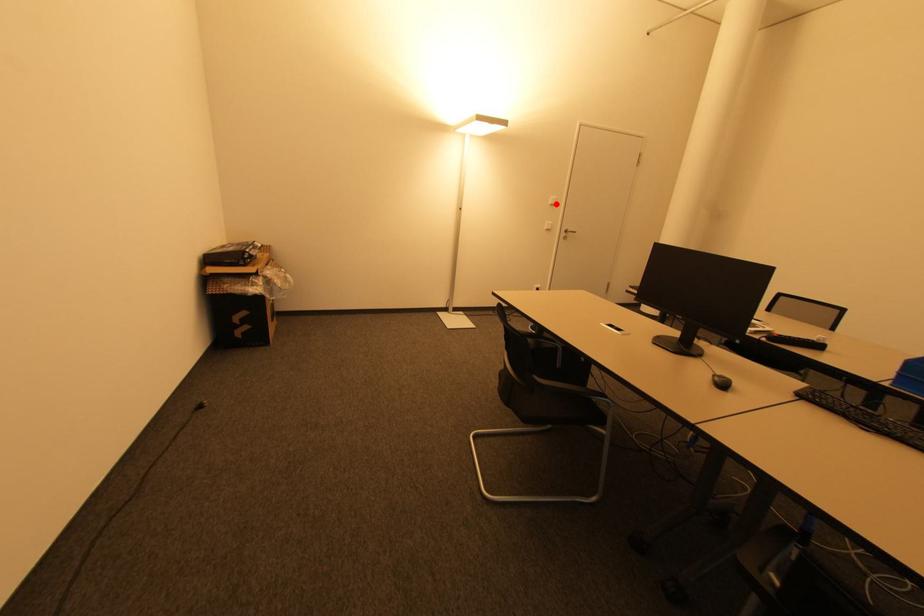
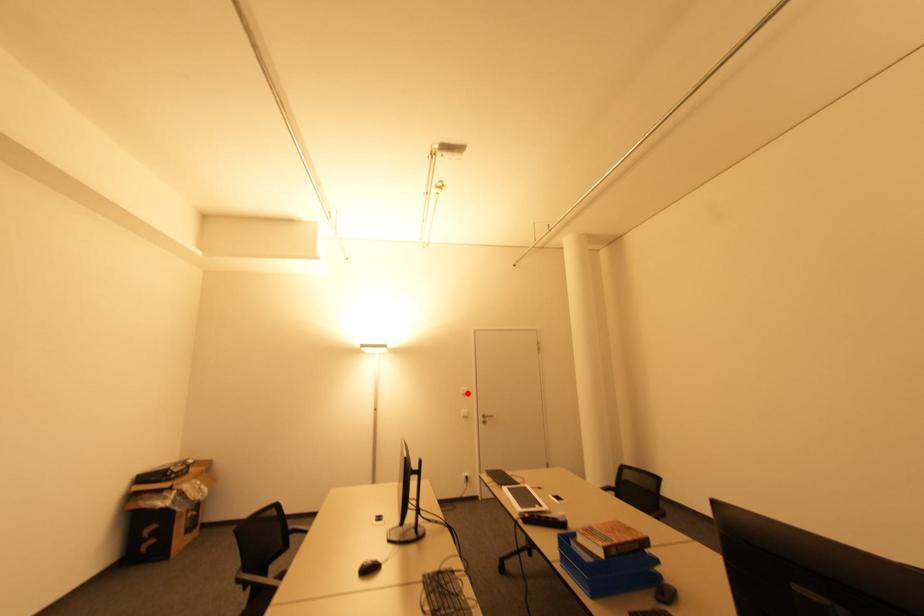
I am providing you with two images of the same scene from different viewpoints. A red point is marked on the first image and another point is marked on the second image. Are the points marked in image1 and image2 representing the same 3D position?

Yes